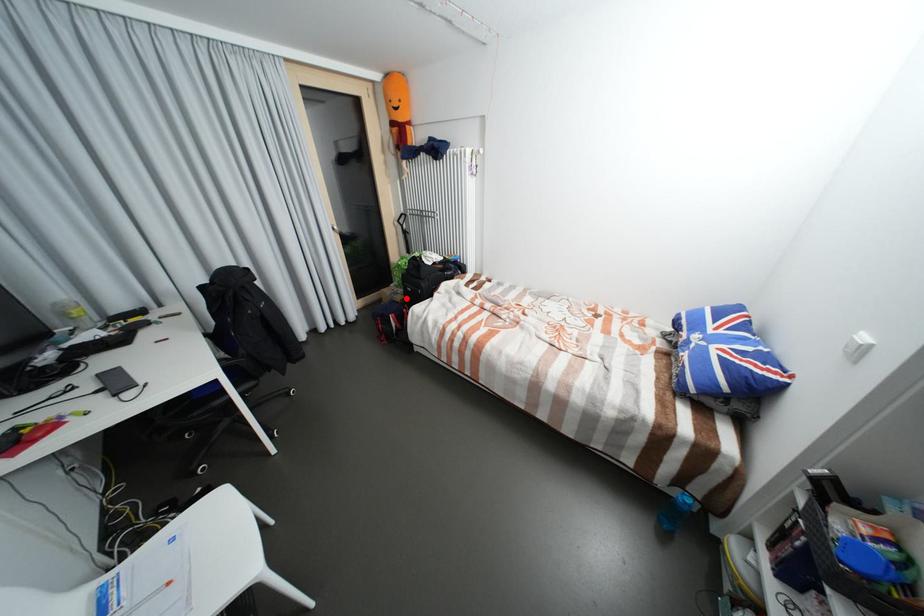
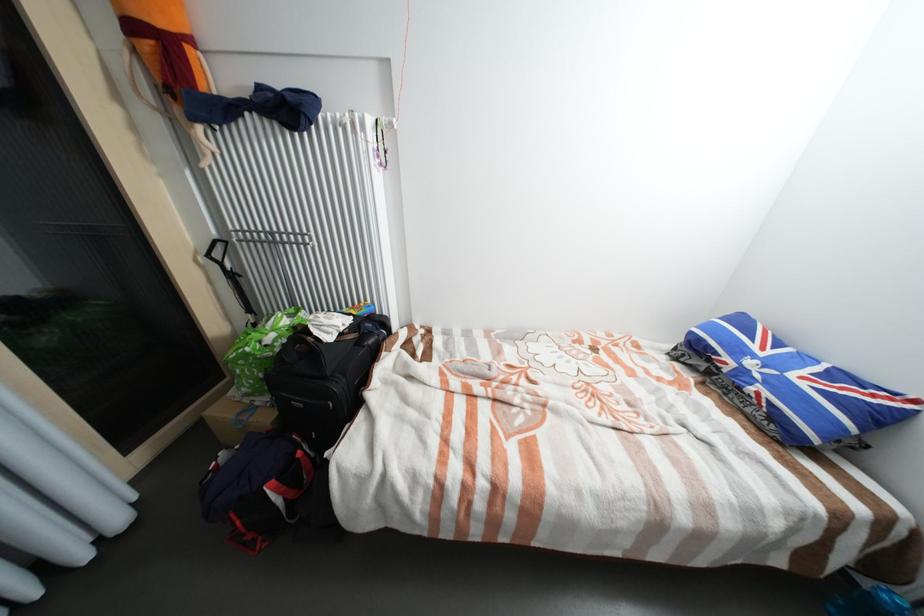
Locate, in the second image, the point that corresponds to the highlighted location in the first image.

(273, 419)